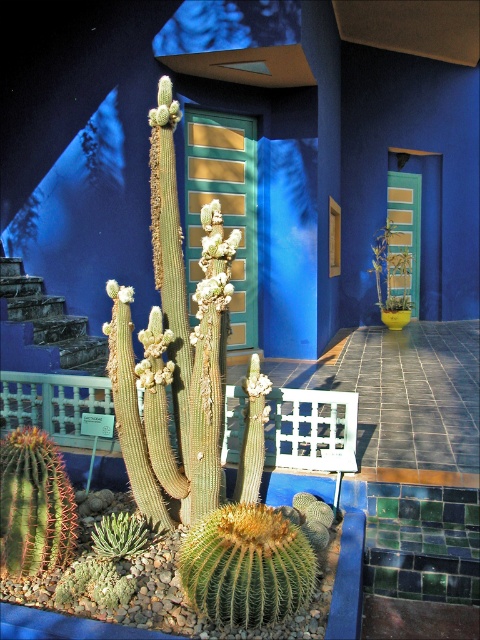
You are standing in the cacti garden and want to touch the succulent spiny at center and the green fuzzy cactus at lower left. Which one can you reach without moving your feet?

The succulent spiny at center is closer to you than the green fuzzy cactus at lower left, so you can reach the succulent spiny at center without moving your feet.

You are a gardener arranging plants in a display. You have two plants to place in the foreground of the cacti garden. The first is the green spiky cactus at lower center, and the second is the green succulent at lower left. According to the existing arrangement, which plant should be placed to the right of the other?

The green spiky cactus at lower center should be placed to the right of the green succulent at lower left because the description states that the green spiky cactus at lower center is to the right of the green succulent at lower left.